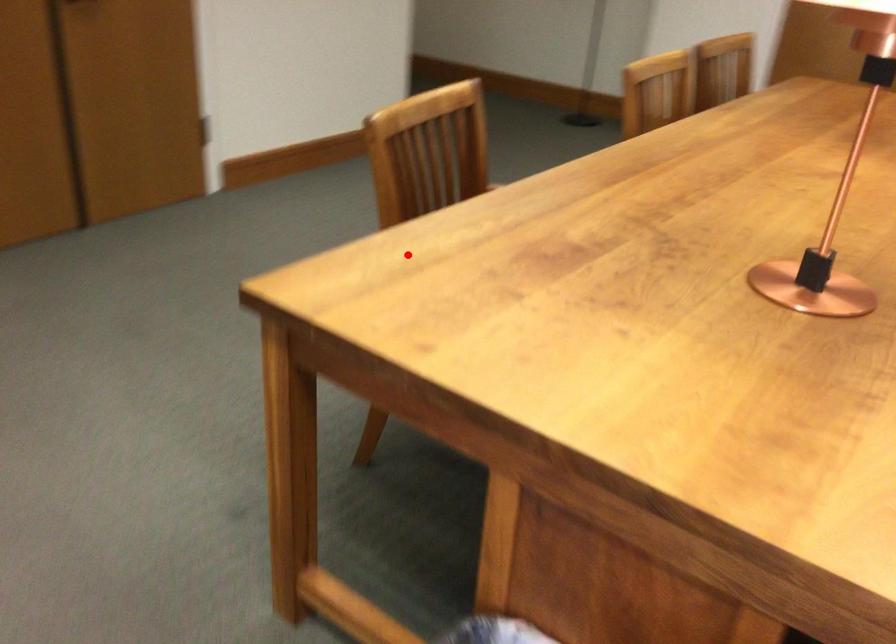
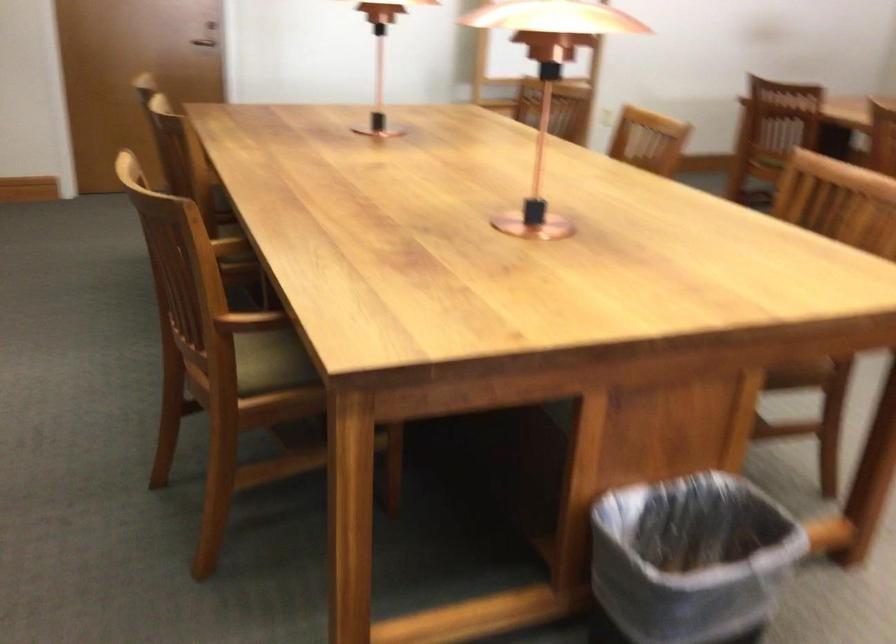
Question: I am providing you with two images of the same scene from different viewpoints. In image1, a red point is highlighted. Considering the same 3D point in image2, which of the following is correct?

Choices:
 (A) It is closer
 (B) It is farther

Answer: (B)